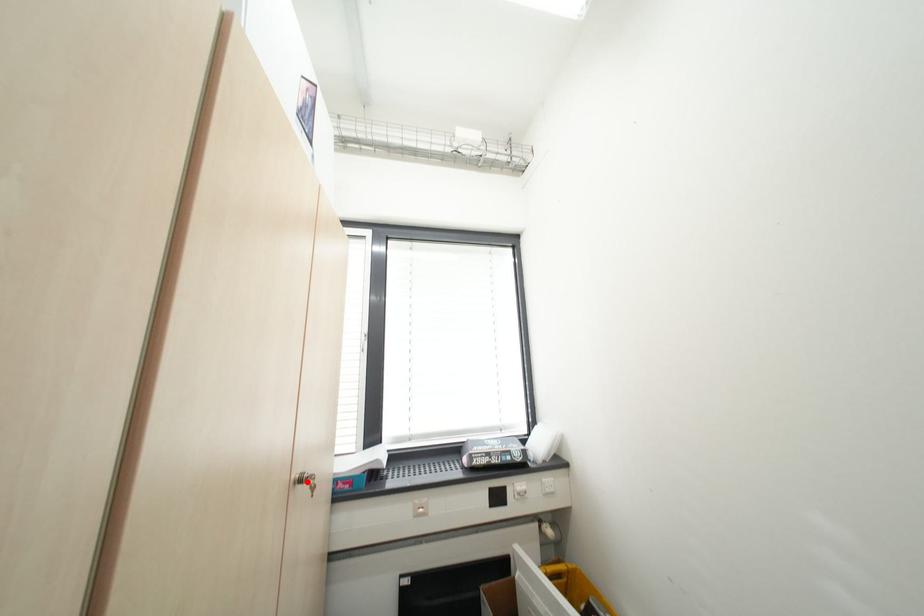
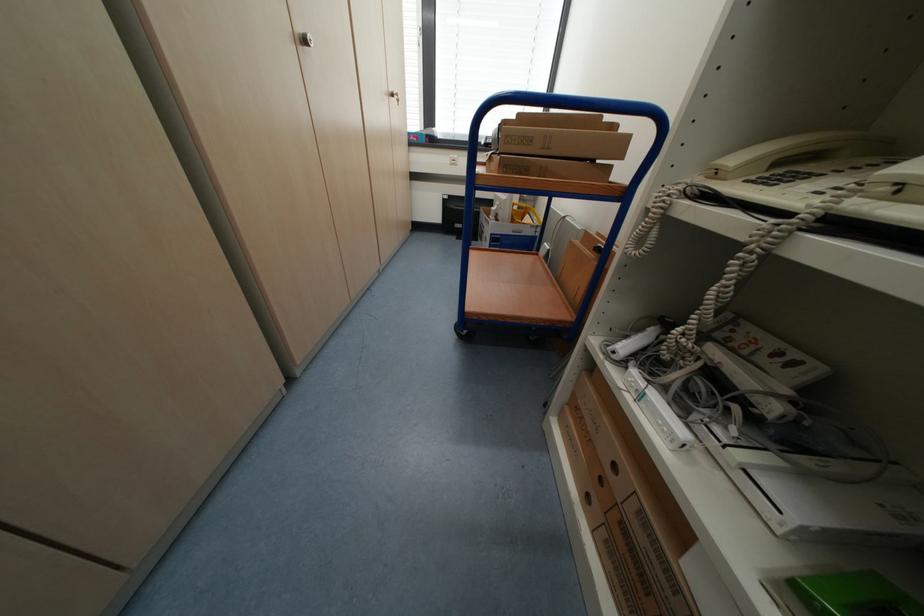
Question: I am providing you with two images of the same scene from different viewpoints. A red point is marked on the first image. Can you still see the location of the red point in image 2?

Choices:
 (A) Yes
 (B) No

Answer: (A)